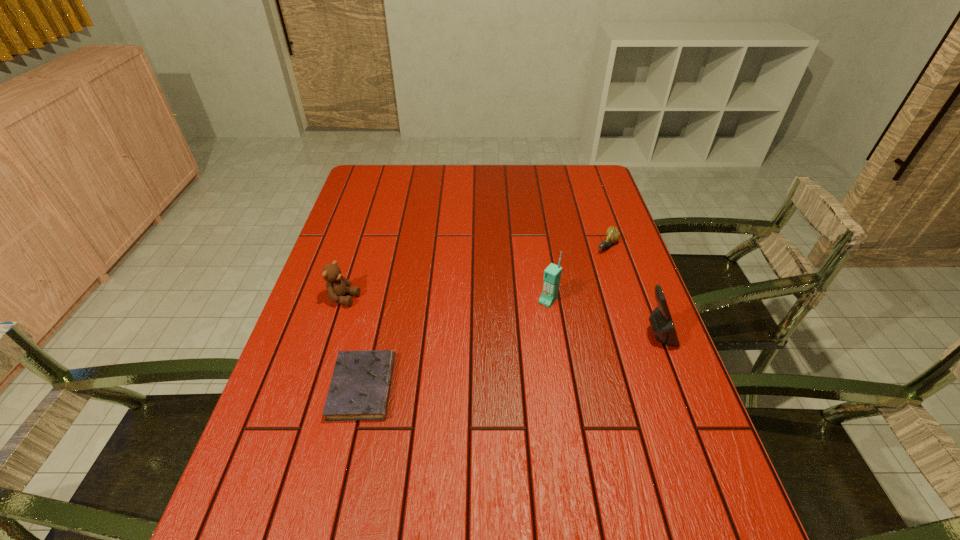
This screenshot has width=960, height=540. In order to click on free space located 0.220m on the front-facing side of the second shortest object in this screenshot , I will do `click(562, 292)`.

At what (x,y) coordinates should I click in order to perform the action: click on free spot located 0.150m on the front-facing side of the second shortest object. Please return your answer as a coordinate pair (x, y). The width and height of the screenshot is (960, 540). Looking at the image, I should click on (574, 279).

This screenshot has height=540, width=960. In order to click on vacant space located on the front-facing side of the second shortest object in this screenshot , I will do `click(564, 291)`.

What are the coordinates of `free point located 0.240m on the keypad of the left cellular telephone` in the screenshot? It's located at (492, 366).

Identify the location of vacant space located on the keypad of the left cellular telephone. (488, 372).

Identify the location of vacant space located 0.250m on the keypad of the left cellular telephone. The width and height of the screenshot is (960, 540). coord(491,369).

Locate an element on the screen. The width and height of the screenshot is (960, 540). free space located 0.380m on the face of the third shortest object is located at coordinates (490, 340).

The width and height of the screenshot is (960, 540). What are the coordinates of `vacant space located on the face of the third shortest object` in the screenshot? It's located at (468, 334).

Where is `vacant space situated on the face of the third shortest object`? This screenshot has width=960, height=540. vacant space situated on the face of the third shortest object is located at coordinates (414, 318).

The image size is (960, 540). In order to click on diary located in the left edge section of the desktop in this screenshot , I will do `click(360, 386)`.